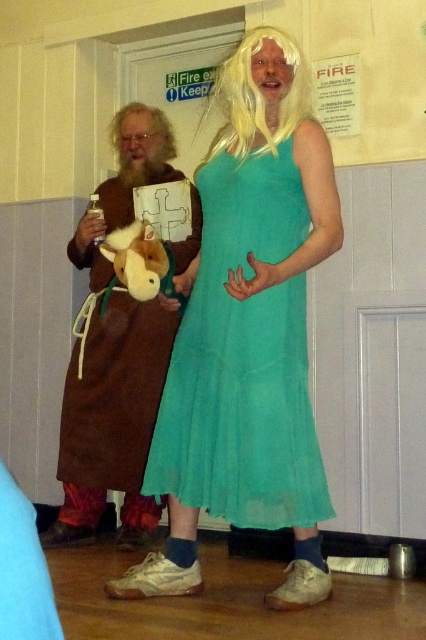
Who is shorter, brown plush toy at left or blonde synthetic wig at upper left?

brown plush toy at left

Which is in front, point (104, 244) or point (166, 156)?

Point (104, 244)

The height and width of the screenshot is (640, 426). Identify the location of brown plush toy at left. (137, 259).

Who is more distant from viewer, (307, 76) or (114, 284)?

Positioned behind is point (114, 284).

Is point (259, 147) less distant than point (138, 244)?

Yes, it is in front of point (138, 244).

Who is more distant from viewer, (285, 136) or (141, 280)?

Point (141, 280)

Identify the location of blonde synthetic wig at center. The height and width of the screenshot is (640, 426). (256, 99).

Does brown leather robe at left have a greater width compared to blonde synthetic wig at upper left?

Yes.

Is point (57, 538) behind point (109, 132)?

No, (57, 538) is in front of (109, 132).

Identify the location of brown leather robe at left. This screenshot has width=426, height=640. (115, 353).